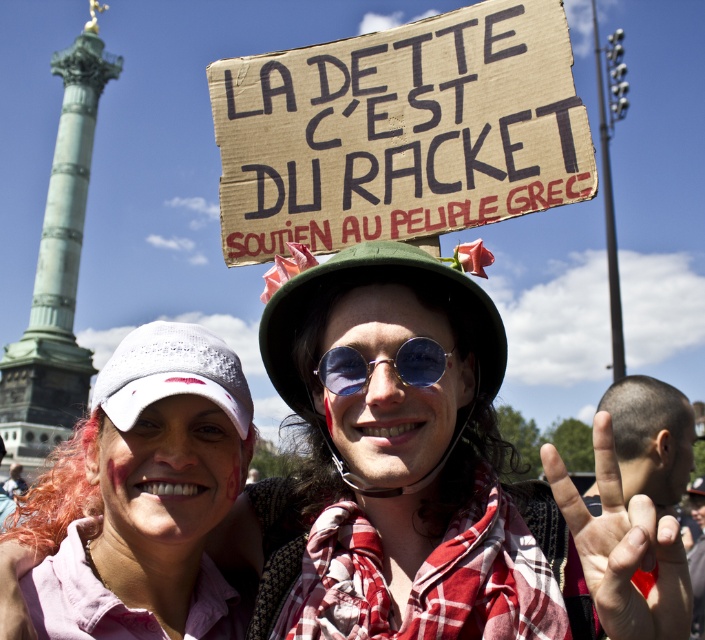
You are a photographer taking a picture of the pink fabric shirt at center and the blue reflective sunglasses at center. Which object should you focus on first if you want to capture both in the same frame without moving the camera?

The pink fabric shirt at center is much taller than the blue reflective sunglasses at center, so you should focus on the pink fabric shirt at center first to ensure it is in frame and properly composed before adjusting for the smaller sunglasses.

In the protest scene, there are two items at the center of the image. The pink fabric shirt at center and the blue reflective sunglasses at center. Which one is positioned to the left?

The pink fabric shirt at center is positioned to the left of the blue reflective sunglasses at center.

What is the object located at the coordinates point (398, 131) in the image?

The point (398, 131) indicates the location of the brown cardboard sign at upper center.